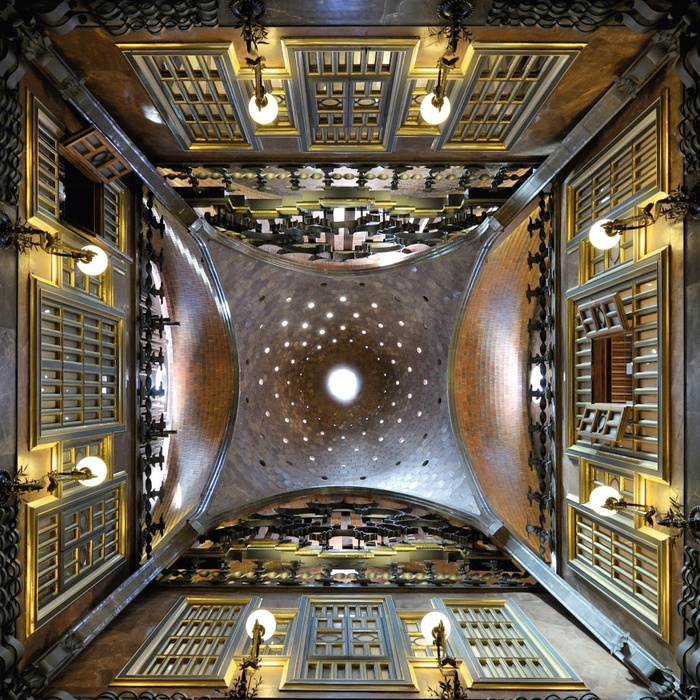
Image resolution: width=700 pixels, height=700 pixels. I want to click on ceiling, so click(476, 383), click(204, 381).